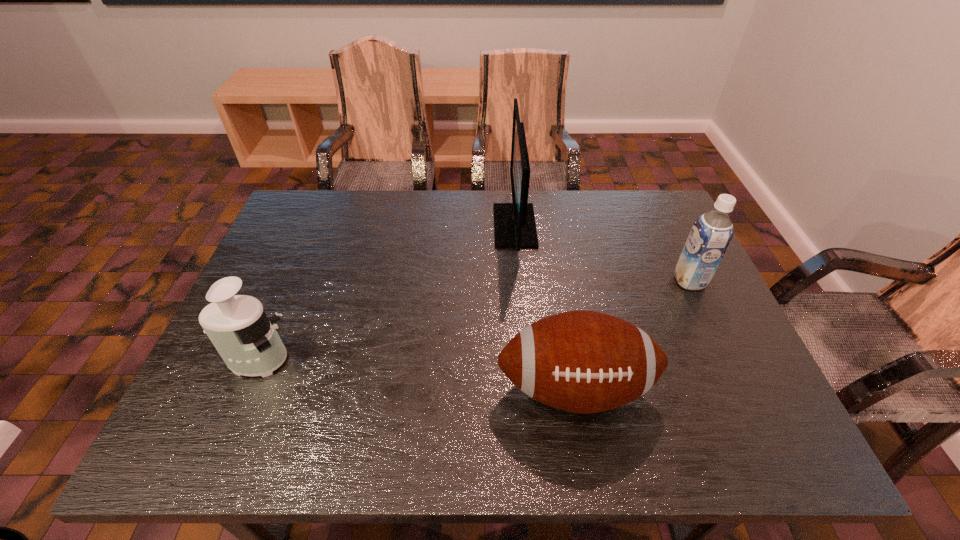
At what (x,y) coordinates should I click in order to perform the action: click on vacant area situated 0.340m on the label of the third nearest object. Please return your answer as a coordinate pair (x, y). This screenshot has height=540, width=960. Looking at the image, I should click on (548, 281).

What are the coordinates of `vacant region located 0.090m on the label of the third nearest object` in the screenshot? It's located at (641, 281).

The width and height of the screenshot is (960, 540). I want to click on free spot located 0.250m on the right of the juicer, so click(x=401, y=360).

In order to click on free space located on the laces of the shortest object in this screenshot , I will do `click(587, 457)`.

What are the coordinates of `object at the far edge` in the screenshot? It's located at (514, 223).

This screenshot has width=960, height=540. In order to click on object present at the near edge in this screenshot , I will do `click(581, 361)`.

Find the location of `object that is at the left edge`. object that is at the left edge is located at coordinates (237, 325).

Find the location of `object that is at the right edge`. object that is at the right edge is located at coordinates (711, 234).

In the image, there is a desktop. Where is `vacant space at the far edge`? This screenshot has height=540, width=960. vacant space at the far edge is located at coordinates (493, 224).

You are a GUI agent. You are given a task and a screenshot of the screen. Output one action in this format:
    pyautogui.click(x=<x>, y=<y>)
    Task: Click on the vacant space at the near edge
    The image size is (960, 540).
    Given the screenshot: What is the action you would take?
    pyautogui.click(x=280, y=442)